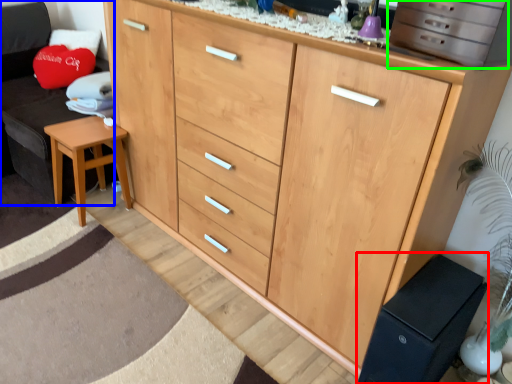
Question: Considering the real-world distances, which object is farthest from changing table (highlighted by a red box)? swivel chair (highlighted by a blue box) or cabinetry (highlighted by a green box)?

Choices:
 (A) swivel chair
 (B) cabinetry

Answer: (A)